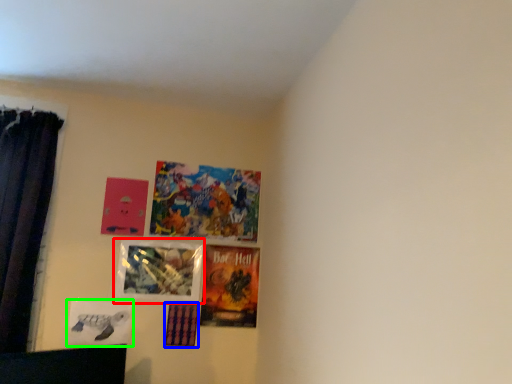
Question: Based on their relative distances, which object is farther from picture frame (highlighted by a red box)? Choose from picture frame (highlighted by a blue box) and picture frame (highlighted by a green box).

Choices:
 (A) picture frame
 (B) picture frame

Answer: (B)